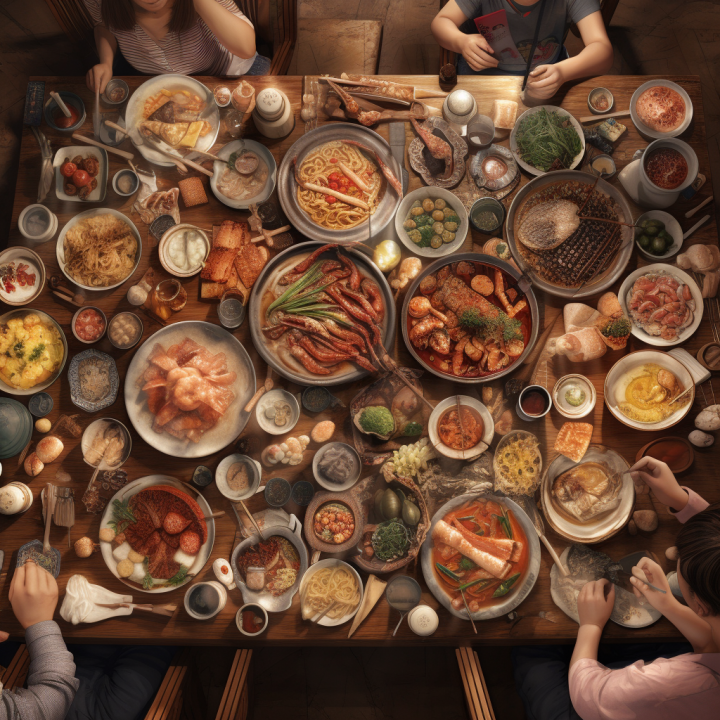
This screenshot has width=720, height=720. I want to click on chair, so click(x=468, y=693), click(x=170, y=701), click(x=276, y=37), click(x=608, y=19).